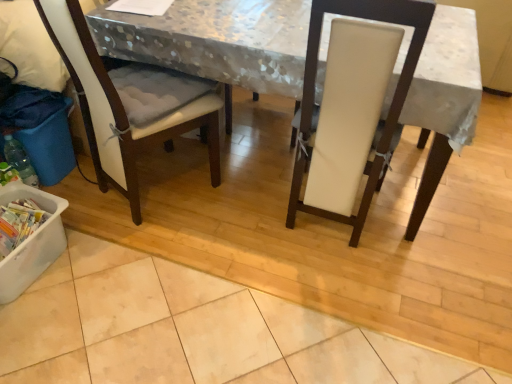
Question: Can you see white plastic container at lower left, marked as the first recycling bin in a bottom-to-top arrangement, touching blue plastic recycling bin at lower left, acting as the first recycling bin starting from the top?

Choices:
 (A) yes
 (B) no

Answer: (B)

Question: Is the depth of white plastic container at lower left, placed as the 2th recycling bin when sorted from top to bottom, greater than that of blue plastic recycling bin at lower left, acting as the first recycling bin starting from the top?

Choices:
 (A) no
 (B) yes

Answer: (A)

Question: Is white plastic container at lower left, placed as the 2th recycling bin when sorted from top to bottom, to the left of blue plastic recycling bin at lower left, which ranks as the second recycling bin in bottom-to-top order, from the viewer's perspective?

Choices:
 (A) yes
 (B) no

Answer: (B)

Question: Is blue plastic recycling bin at lower left, which ranks as the second recycling bin in bottom-to-top order, inside white plastic container at lower left, placed as the 2th recycling bin when sorted from top to bottom?

Choices:
 (A) yes
 (B) no

Answer: (B)

Question: From the image's perspective, is white plastic container at lower left, placed as the 2th recycling bin when sorted from top to bottom, above blue plastic recycling bin at lower left, which ranks as the second recycling bin in bottom-to-top order?

Choices:
 (A) yes
 (B) no

Answer: (B)

Question: Is white plastic container at lower left, placed as the 2th recycling bin when sorted from top to bottom, positioned far away from blue plastic recycling bin at lower left, acting as the first recycling bin starting from the top?

Choices:
 (A) yes
 (B) no

Answer: (B)

Question: Is blue plastic recycling bin at lower left, acting as the first recycling bin starting from the top, oriented away from white leather chair at center, which is the 1th chair from right to left?

Choices:
 (A) no
 (B) yes

Answer: (A)

Question: Is blue plastic recycling bin at lower left, which ranks as the second recycling bin in bottom-to-top order, oriented towards white leather chair at center, the second chair when ordered from left to right?

Choices:
 (A) no
 (B) yes

Answer: (B)

Question: Does blue plastic recycling bin at lower left, acting as the first recycling bin starting from the top, lie behind white leather chair at center, the second chair when ordered from left to right?

Choices:
 (A) yes
 (B) no

Answer: (A)

Question: Are blue plastic recycling bin at lower left, acting as the first recycling bin starting from the top, and white leather chair at center, the second chair when ordered from left to right, located far from each other?

Choices:
 (A) no
 (B) yes

Answer: (B)

Question: From a real-world perspective, is blue plastic recycling bin at lower left, which ranks as the second recycling bin in bottom-to-top order, on white leather chair at center, which is the 1th chair from right to left?

Choices:
 (A) no
 (B) yes

Answer: (A)

Question: Is blue plastic recycling bin at lower left, acting as the first recycling bin starting from the top, to the right of white leather chair at center, the second chair when ordered from left to right, from the viewer's perspective?

Choices:
 (A) yes
 (B) no

Answer: (B)

Question: Can you confirm if white fabric-covered table at center is thinner than blue plastic recycling bin at lower left, acting as the first recycling bin starting from the top?

Choices:
 (A) no
 (B) yes

Answer: (A)